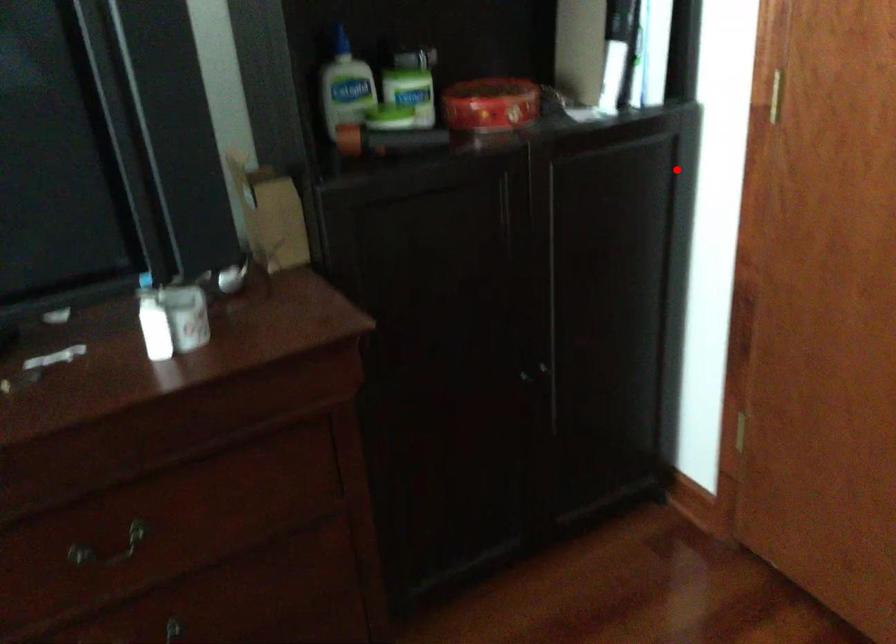
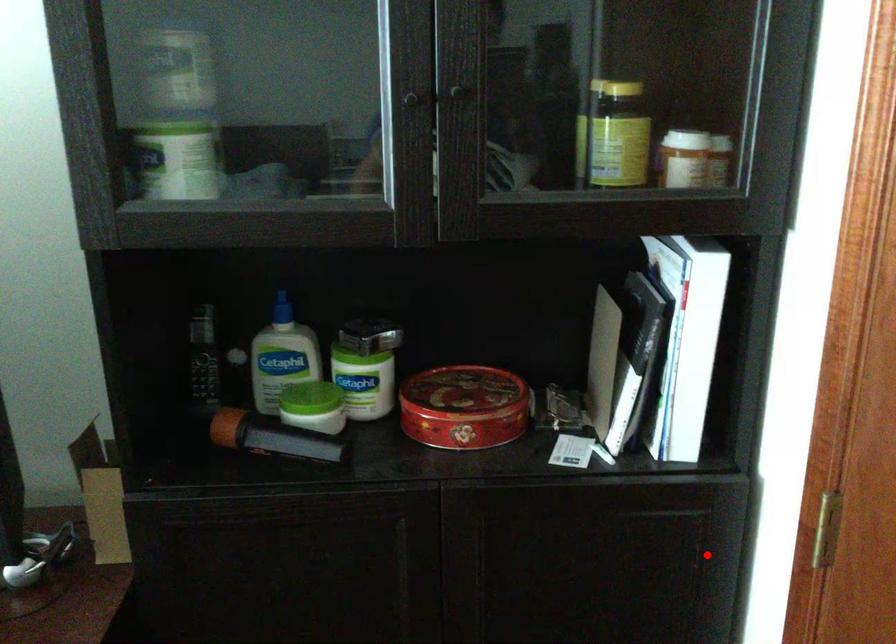
I am providing you with two images of the same scene from different viewpoints. A red point is marked on the first image and another point is marked on the second image. Are the points marked in image1 and image2 representing the same 3D position?

Yes